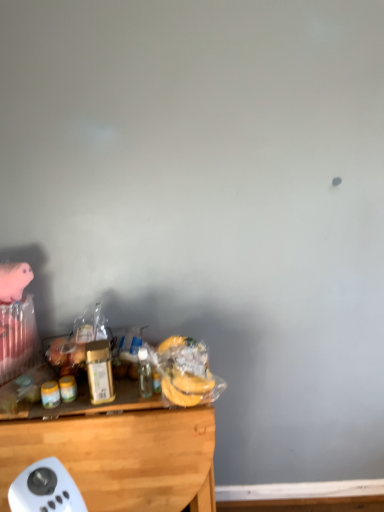
Locate an element on the screen. vacant space to the right of metallic gold canister at center, the first bottle positioned from the left is located at coordinates (132, 396).